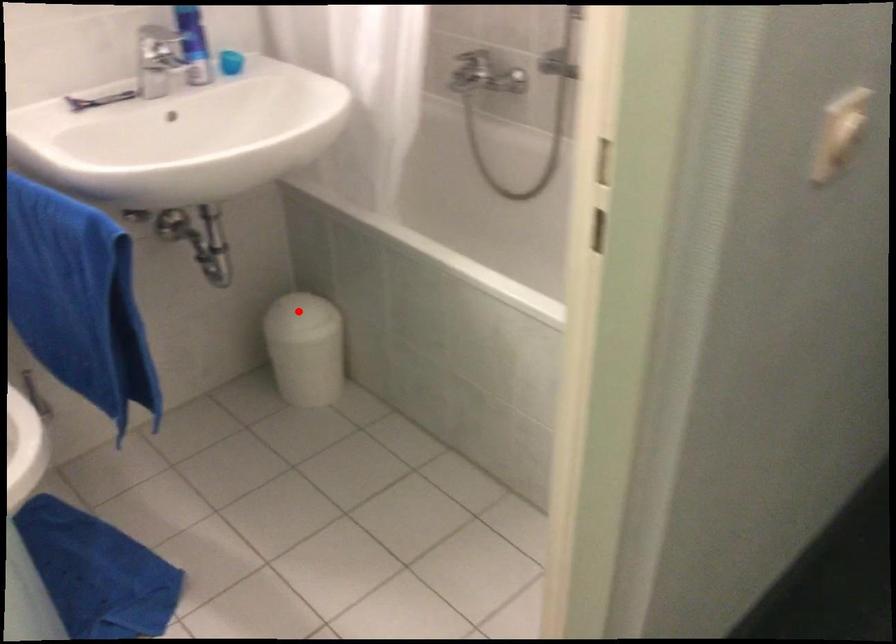
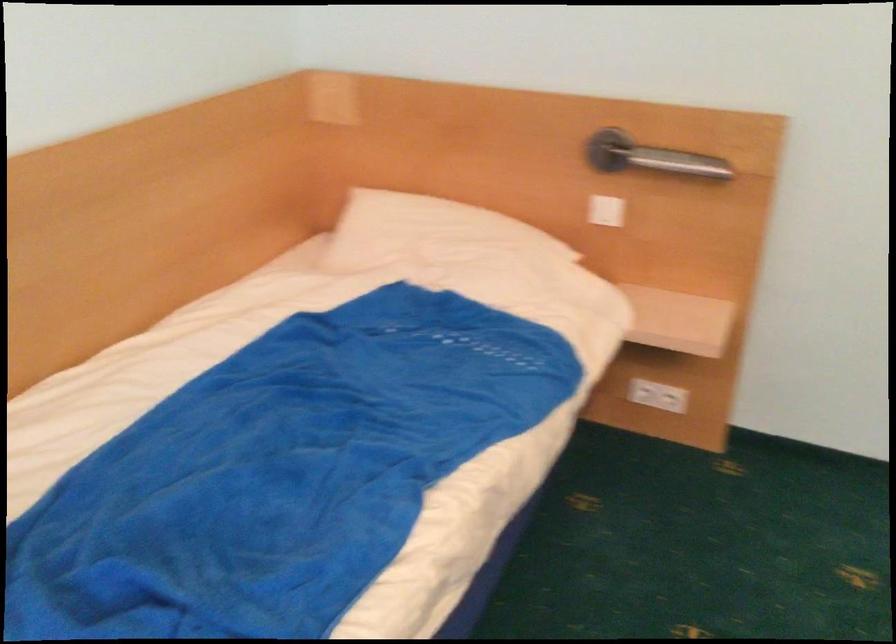
Question: I am providing you with two images of the same scene from different viewpoints. A red point is marked on the first image. Is the red point's position out of view in image 2?

Choices:
 (A) Yes
 (B) No

Answer: (A)